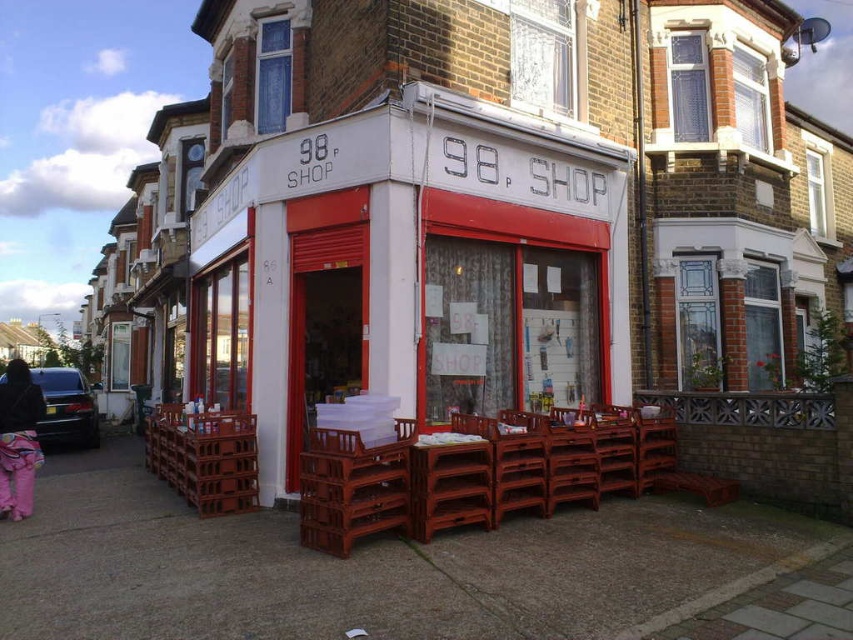
You are a customer standing in front of the 98p Shop. You see a brown wooden crate at lower left and a brown wooden chair at center. Which object is bigger?

The brown wooden crate at lower left is larger than the brown wooden chair at center.

You are a customer standing in front of the 98p Shop. You see the matte white sign at center and the brown wooden crates at lower center. Which object is positioned higher relative to the other?

The matte white sign at center is located above the brown wooden crates at lower center, so it is positioned higher.

You are a customer standing in front of the 98p Shop. You see a brown wooden crate at center and a brown wooden chair at center. Which object is taller?

The brown wooden crate at center is taller than the brown wooden chair at center.